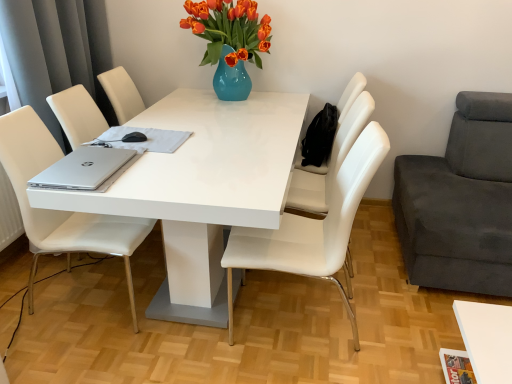
Question: Which direction should I rotate to look at white leather chair at center, the 2th chair in the left-to-right sequence, — up or down?

Choices:
 (A) up
 (B) down

Answer: (B)

Question: From a real-world perspective, is white cloth at center on top of dark gray fabric couch at right, which is the 1th chair from right to left?

Choices:
 (A) yes
 (B) no

Answer: (A)

Question: From a real-world perspective, is white cloth at center physically below dark gray fabric couch at right, the fourth chair in the left-to-right sequence?

Choices:
 (A) yes
 (B) no

Answer: (B)

Question: Does white cloth at center turn towards dark gray fabric couch at right, the fourth chair in the left-to-right sequence?

Choices:
 (A) yes
 (B) no

Answer: (B)

Question: Is white cloth at center turned away from dark gray fabric couch at right, the fourth chair in the left-to-right sequence?

Choices:
 (A) no
 (B) yes

Answer: (A)

Question: From the image's perspective, would you say white cloth at center is shown under dark gray fabric couch at right, the fourth chair in the left-to-right sequence?

Choices:
 (A) yes
 (B) no

Answer: (B)

Question: Is white cloth at center positioned behind dark gray fabric couch at right, which is the 1th chair from right to left?

Choices:
 (A) no
 (B) yes

Answer: (B)

Question: Is the position of white leather chair at center, the 3th chair in the right-to-left sequence, more distant than that of silver metallic laptop at left?

Choices:
 (A) yes
 (B) no

Answer: (B)

Question: Is white leather chair at center, the 2th chair in the left-to-right sequence, positioned beyond the bounds of silver metallic laptop at left?

Choices:
 (A) yes
 (B) no

Answer: (A)

Question: From the image's perspective, is white leather chair at center, the 3th chair in the right-to-left sequence, located above silver metallic laptop at left?

Choices:
 (A) no
 (B) yes

Answer: (A)

Question: Is white leather chair at center, the 3th chair in the right-to-left sequence, thinner than silver metallic laptop at left?

Choices:
 (A) yes
 (B) no

Answer: (B)

Question: Does white leather chair at center, the 2th chair in the left-to-right sequence, have a greater width compared to silver metallic laptop at left?

Choices:
 (A) yes
 (B) no

Answer: (A)

Question: Would you say white leather chair at center, the 3th chair in the right-to-left sequence, contains silver metallic laptop at left?

Choices:
 (A) no
 (B) yes

Answer: (A)

Question: Does white cloth at center have a lesser width compared to silver metallic laptop at left?

Choices:
 (A) no
 (B) yes

Answer: (B)